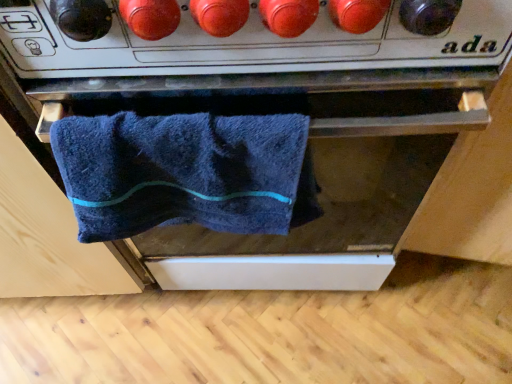
Locate an element on the screen. Image resolution: width=512 pixels, height=384 pixels. free point above dark blue towel at center (from a real-world perspective) is located at coordinates (170, 115).